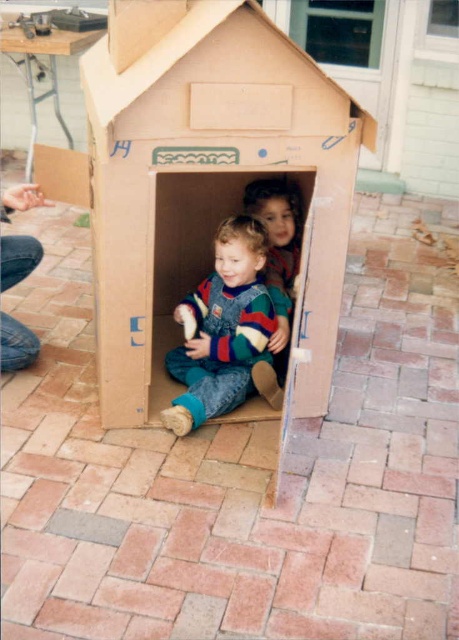
Which object corresponds to the coordinates point [223,330]?

The coordinates point [223,330] correspond to the matte blue overalls at center.

You are a parent trying to take a photo of your children playing. You want to ensure both the cardboard house at center and the matte blue overalls at center are fully visible in the frame. Based on their sizes, which object should you position closer to the camera to avoid cropping?

Since the cardboard house at center is wider than the matte blue overalls at center, you should position the matte blue overalls at center closer to the camera to ensure both fit within the frame without cropping.